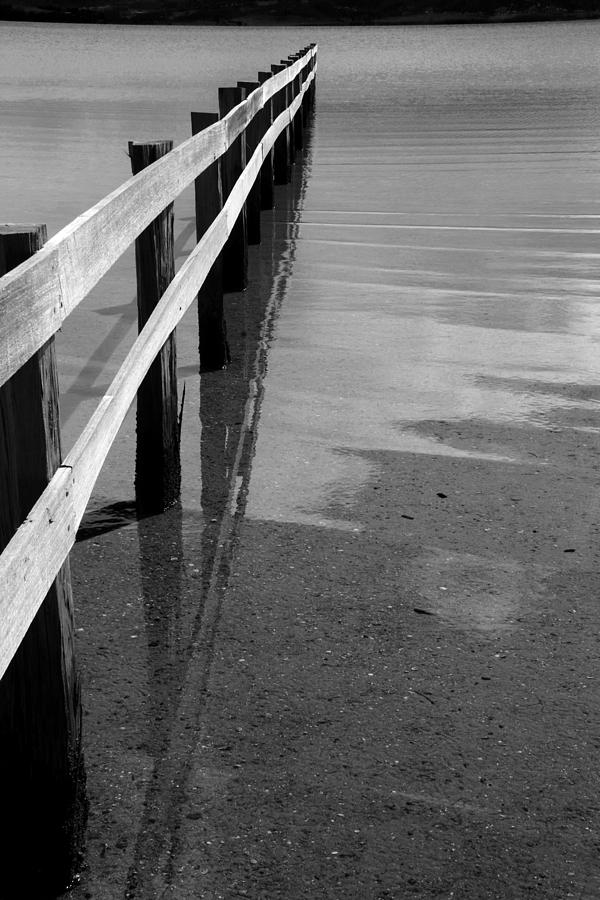
This screenshot has width=600, height=900. Find the location of `wood boards`. wood boards is located at coordinates (30, 299), (96, 428), (250, 112), (246, 180), (276, 86), (294, 73), (269, 148), (300, 93), (301, 63).